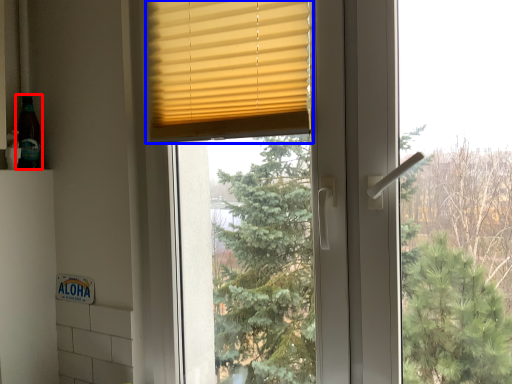
Question: Which point is further to the camera, bottle (highlighted by a red box) or window blind (highlighted by a blue box)?

Choices:
 (A) bottle
 (B) window blind

Answer: (A)